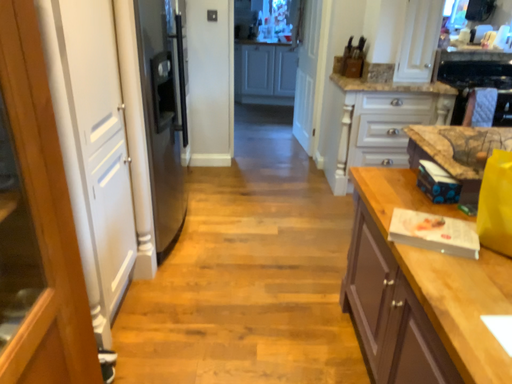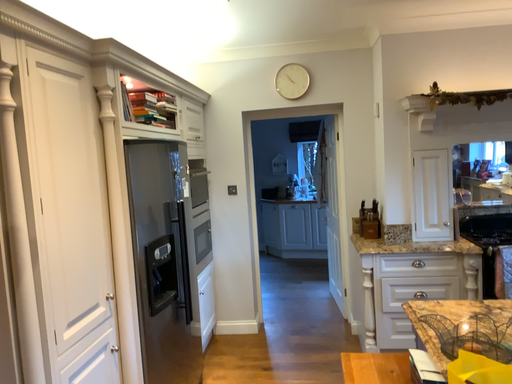
Question: How did the camera likely rotate when shooting the video?

Choices:
 (A) rotated left
 (B) rotated right

Answer: (A)